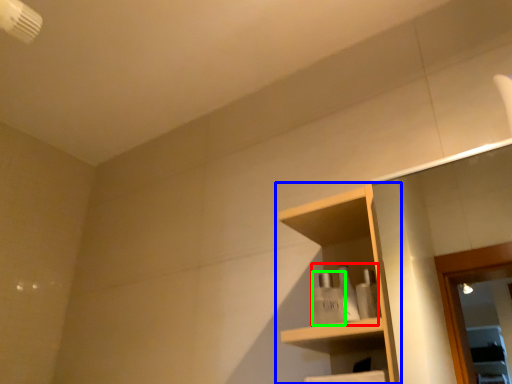
Question: Which object is positioned farthest from toiletry (highlighted by a red box)? Select from shelf (highlighted by a blue box) and toiletry (highlighted by a green box).

Choices:
 (A) shelf
 (B) toiletry

Answer: (A)